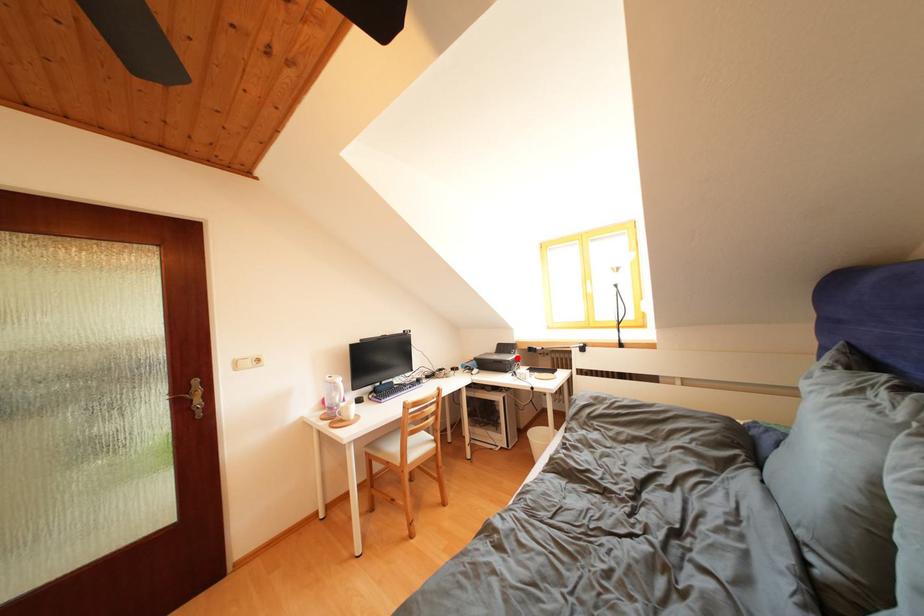
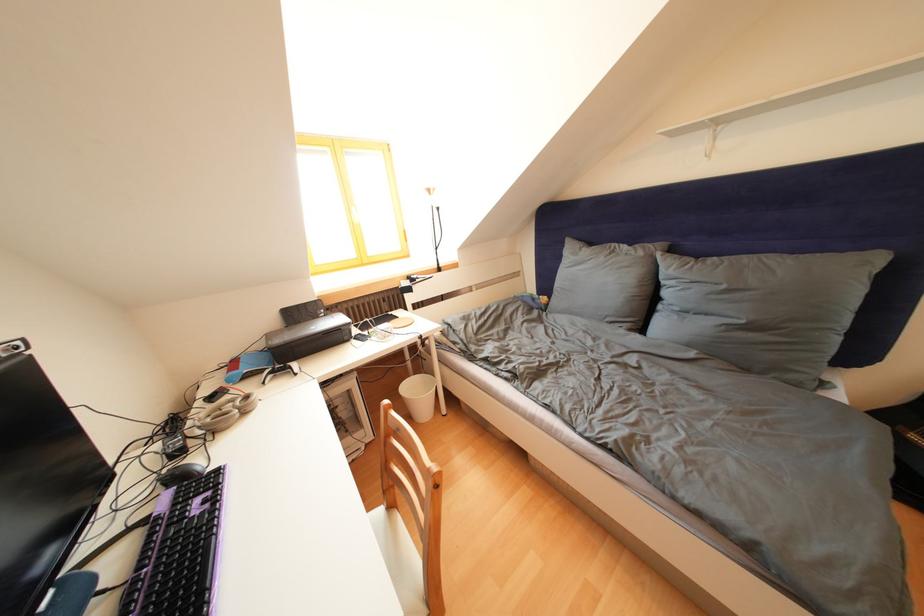
Question: I am providing you with two images of the same scene from different viewpoints. A red point is marked on the first image. Can you still see the location of the red point in image 2?

Choices:
 (A) Yes
 (B) No

Answer: (A)